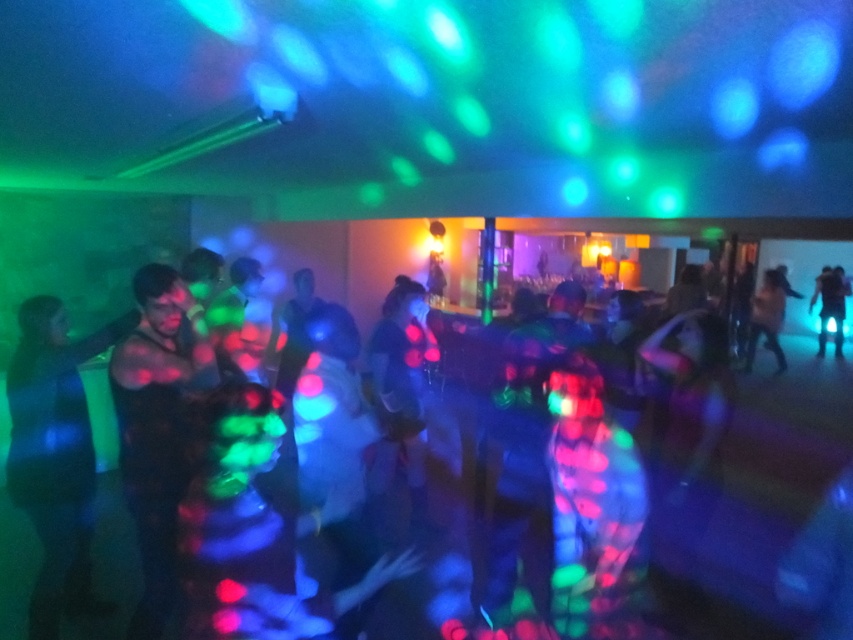
You are at a party where the lighting is very bright and colorful. You notice two items in the crowd that stand out due to their glow or reflection. The first is neon glow clothing at center, and the second is blue reflective pants at right. Which of these two items appears bigger in size?

The neon glow clothing at center appears bigger in size compared to the blue reflective pants at right because it has a larger size according to the description.

You are a photographer trying to capture a clear shot of both the neon glow clothing at center and the shiny blue dress at left. Since the subjects are moving, you need to adjust your camera settings. Which clothing item should you focus on first to ensure it stays in frame given their positions?

The neon glow clothing at center is to the right of the shiny blue dress at left. Since the shiny blue dress at left is positioned closer to the left edge of the frame, focusing on it first would help maintain its visibility as the subjects move, especially if they continue moving in their current direction.

Consider the image. You are at a party with a neon glow clothing at center and a shiny blue dress at left. Which piece of clothing is closer to you?

The neon glow clothing at center is closer to you than the shiny blue dress at left.